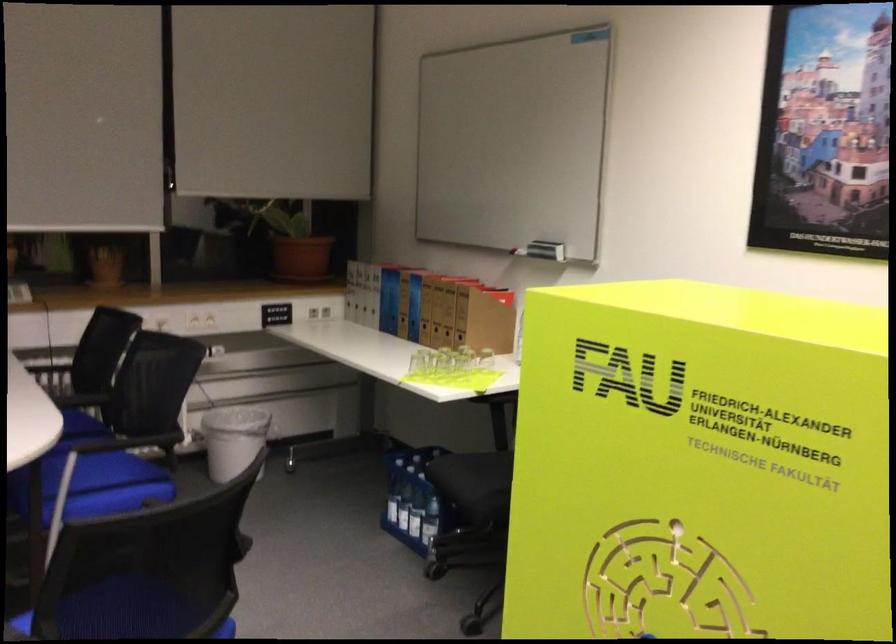
I want to click on brown binder spine hole, so click(x=398, y=317).